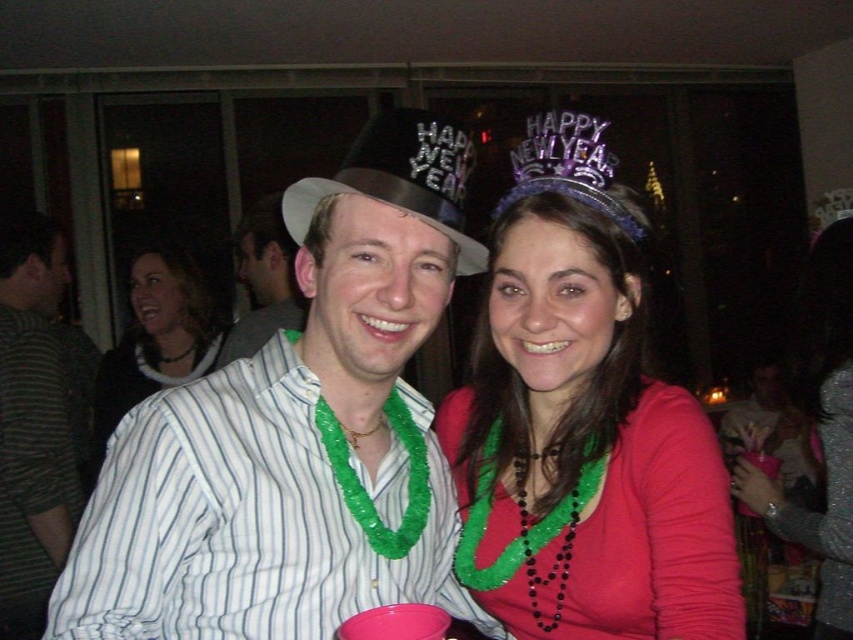
This screenshot has height=640, width=853. Describe the element at coordinates (819, 429) in the screenshot. I see `sparkly silver dress at lower right` at that location.

Which is behind, point (822, 269) or point (369, 432)?

The point (822, 269) is behind.

This screenshot has width=853, height=640. I want to click on sparkly silver dress at lower right, so click(819, 429).

Between point (593, 540) and point (380, 150), which one is positioned behind?

The point (593, 540) is more distant.

What do you see at coordinates (581, 426) in the screenshot? The width and height of the screenshot is (853, 640). I see `pink matte shirt at center` at bounding box center [581, 426].

This screenshot has width=853, height=640. Find the location of `pink matte shirt at center`. pink matte shirt at center is located at coordinates (581, 426).

Who is positioned more to the left, striped shirt at left or matte black necklace at upper left?

striped shirt at left

Is striped shirt at left positioned at the back of matte black necklace at upper left?

No.

Does point (16, 474) come farther from viewer compared to point (117, 349)?

No.

The width and height of the screenshot is (853, 640). I want to click on striped shirt at left, so click(33, 422).